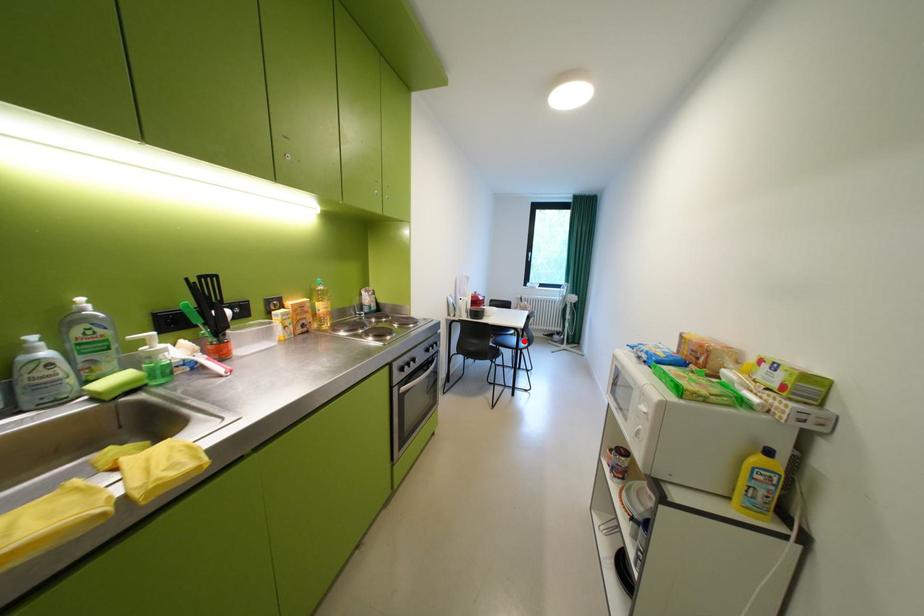
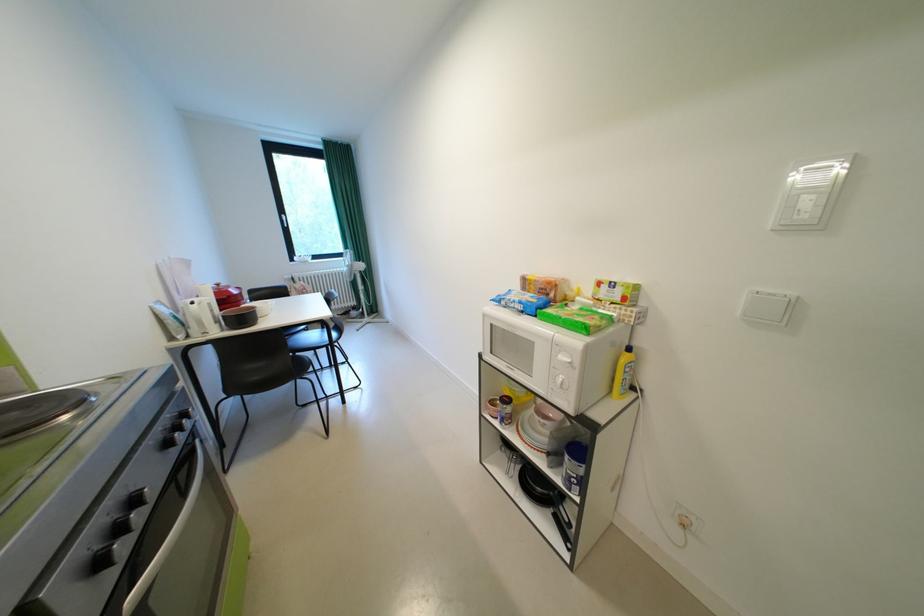
Question: A red point is marked in image1. In image2, is the corresponding 3D point closer to the camera or farther? Reply with the corresponding letter.

Choices:
 (A) The corresponding 3D point is closer.
 (B) The corresponding 3D point is farther.

Answer: (A)